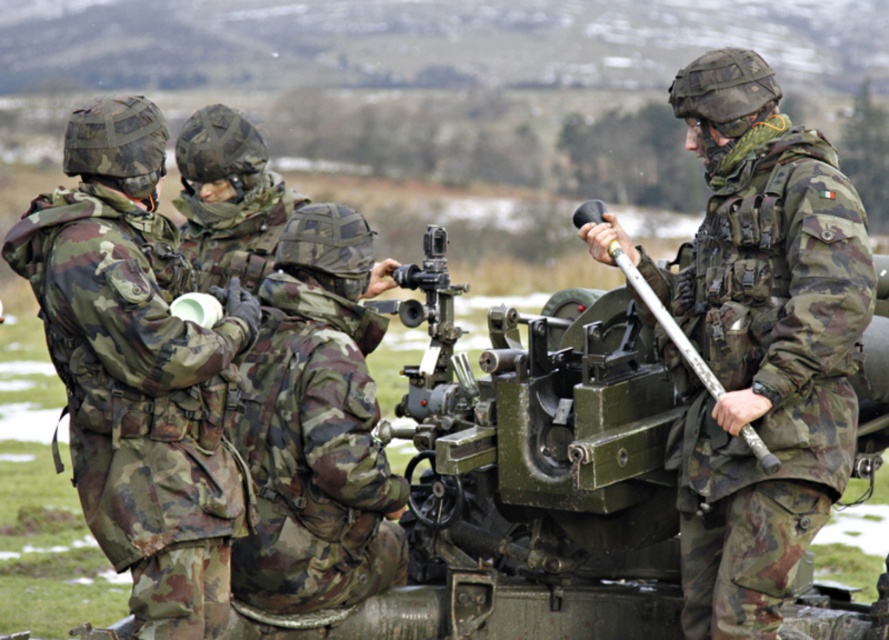
You are a military analyst observing the scene. Based on the positions of the camouflage fabric helmet at center and the metallic green gun at right, which object is positioned higher in the image?

The metallic green gun at right is higher than the camouflage fabric helmet at center, so the metallic green gun at right is positioned higher in the image.

You are a military trainee observing the soldiers and their equipment. Which object is shorter in height between the camouflage fabric helmet at center and the metallic green gun at right?

The camouflage fabric helmet at center has a lesser height compared to the metallic green gun at right, so the camouflage fabric helmet at center is shorter.

You are a soldier in the group and need to locate your helmet and the gun quickly. Based on the scene, where is the camouflage fabric helmet at upper left relative to the metallic green gun at right?

The camouflage fabric helmet at upper left is positioned on the left side of the metallic green gun at right, so the helmet is to the left of the gun.